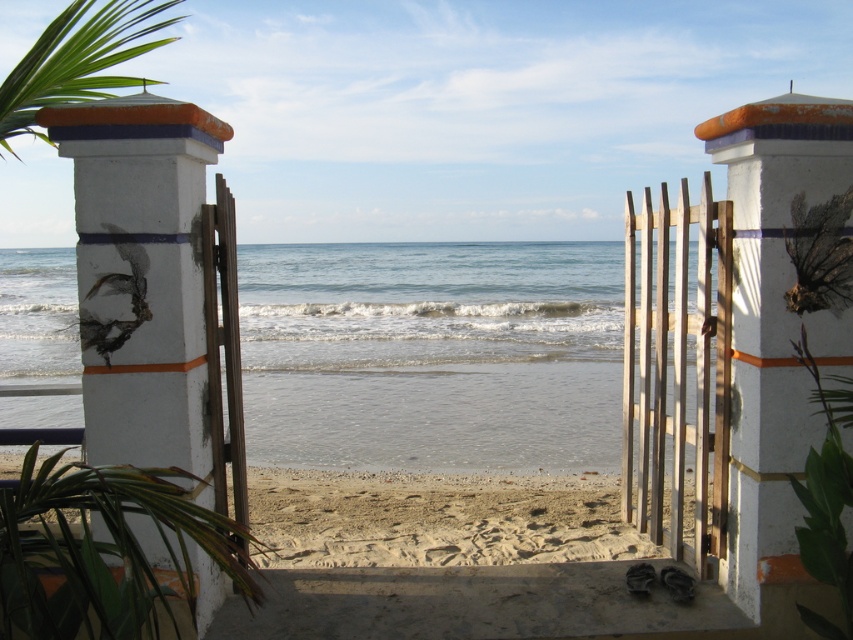
You are a photographer planning to capture the entire scene through the open wooden gate. Considering the white painted concrete pillar at right and the beige sandy beach at center, which object appears narrower in your photo?

The white painted concrete pillar at right appears narrower in the photo compared to the beige sandy beach at center because it has a lesser width.

You are standing in front of the open wooden gate and see the white painted concrete pillar at right and the white painted concrete pillar at left. Which pillar is closer to you?

The white painted concrete pillar at right is positioned under the white painted concrete pillar at left, meaning it is closer to you.